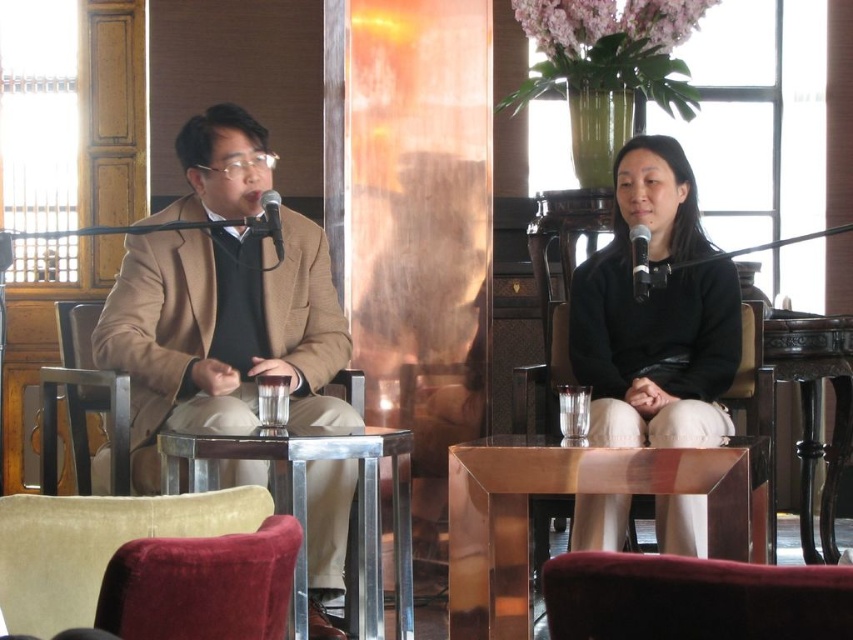
Can you confirm if black matte sweater at center is positioned to the left of metallic silver table at center?

In fact, black matte sweater at center is to the right of metallic silver table at center.

Is point (662, 364) positioned behind point (409, 572)?

That is True.

The width and height of the screenshot is (853, 640). I want to click on black matte sweater at center, so click(x=654, y=314).

Can you confirm if metallic gold table at center is positioned below black polished wood table at right?

Indeed, metallic gold table at center is positioned under black polished wood table at right.

Looking at this image, does metallic gold table at center have a greater height compared to black polished wood table at right?

Incorrect, metallic gold table at center's height is not larger of black polished wood table at right's.

Is point (486, 563) positioned after point (817, 317)?

That is False.

Find the location of a particular element. Image resolution: width=853 pixels, height=640 pixels. metallic gold table at center is located at coordinates (572, 493).

Between matte brown blazer at left and black polished wood table at right, which one is positioned lower?

black polished wood table at right

Who is positioned more to the left, matte brown blazer at left or black polished wood table at right?

matte brown blazer at left

Who is more forward, (196, 348) or (833, 524)?

Point (196, 348) is more forward.

Identify the location of matte brown blazer at left. (222, 332).